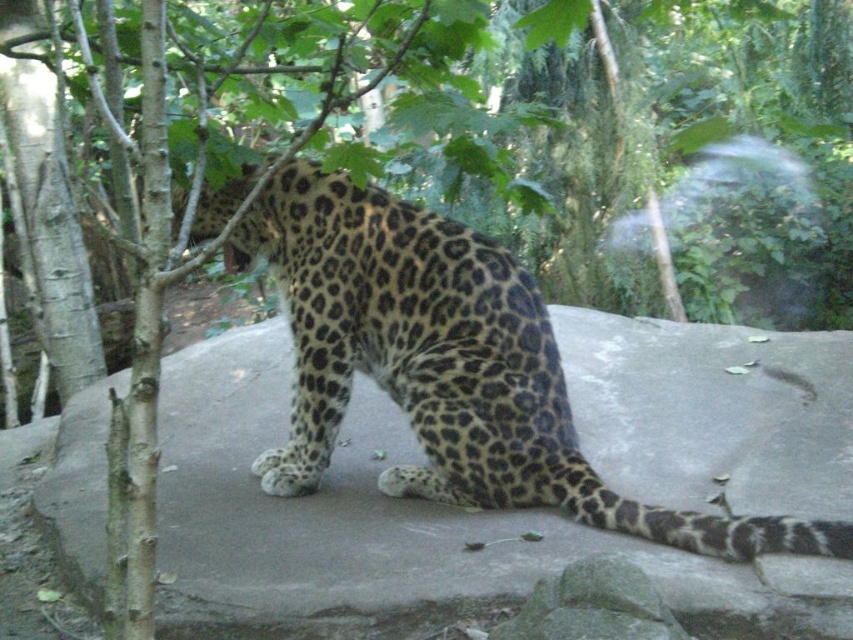
Question: Does gray concrete boulder at center have a larger size compared to spotted fur leopard at center?

Choices:
 (A) yes
 (B) no

Answer: (A)

Question: Which point appears closest to the camera in this image?

Choices:
 (A) (396, 387)
 (B) (421, 620)

Answer: (B)

Question: Can you confirm if gray concrete boulder at center is positioned to the left of spotted fur leopard at center?

Choices:
 (A) yes
 (B) no

Answer: (A)

Question: Does gray concrete boulder at center lie behind spotted fur leopard at center?

Choices:
 (A) no
 (B) yes

Answer: (A)

Question: Which point is farther to the camera?

Choices:
 (A) (646, 524)
 (B) (671, 596)

Answer: (A)

Question: Which of the following is the closest to the observer?

Choices:
 (A) spotted fur leopard at center
 (B) gray concrete boulder at center

Answer: (B)